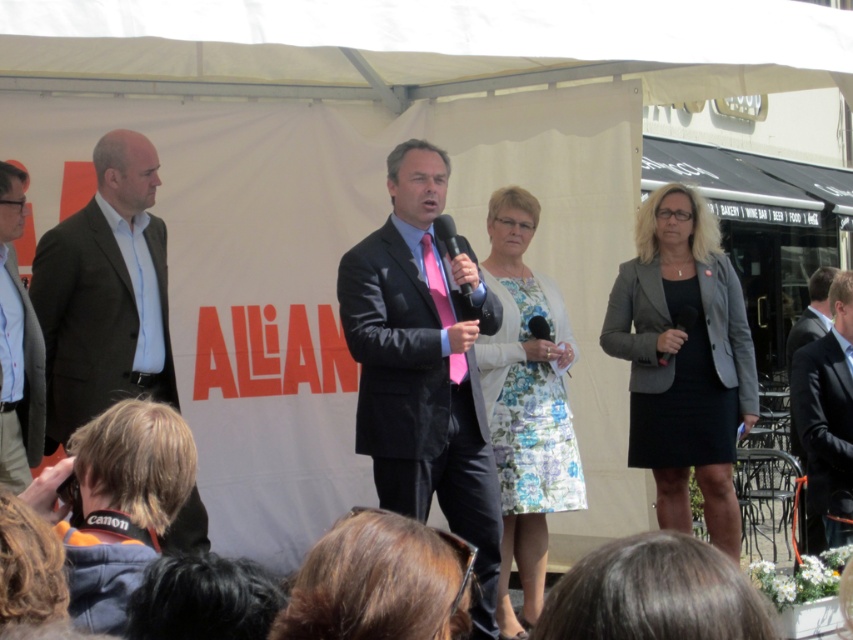
Question: Can you confirm if gray fabric blazer at right is thinner than floral fabric dress at center?

Choices:
 (A) no
 (B) yes

Answer: (A)

Question: Among these points, which one is farthest from the camera?

Choices:
 (A) tap(434, 220)
 (B) tap(368, 611)

Answer: (A)

Question: Considering the real-world distances, which object is closest to the black suit at right?

Choices:
 (A) gray fabric blazer at right
 (B) matte black suit at center
 (C) floral fabric dress at center

Answer: (A)

Question: Which of these objects is positioned closest to the matte black suit at center?

Choices:
 (A) shiny black microphone at center
 (B) black suit at right

Answer: (A)

Question: Does brown hair at center appear on the right side of shiny black microphone at center?

Choices:
 (A) no
 (B) yes

Answer: (A)

Question: Does dark brown suit at left appear on the right side of floral fabric dress at center?

Choices:
 (A) yes
 (B) no

Answer: (B)